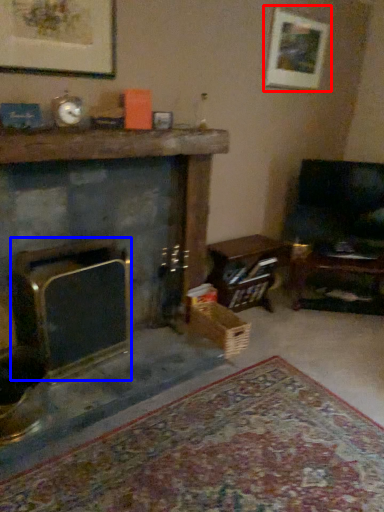
Question: Which object appears farthest to the camera in this image, picture frame (highlighted by a red box) or fireplace (highlighted by a blue box)?

Choices:
 (A) picture frame
 (B) fireplace

Answer: (A)